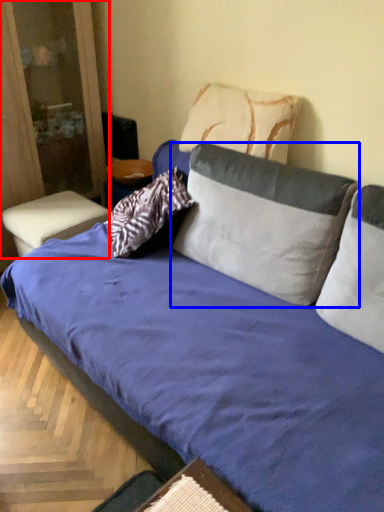
Question: Which point is further to the camera, dresser (highlighted by a red box) or pillow (highlighted by a blue box)?

Choices:
 (A) dresser
 (B) pillow

Answer: (A)